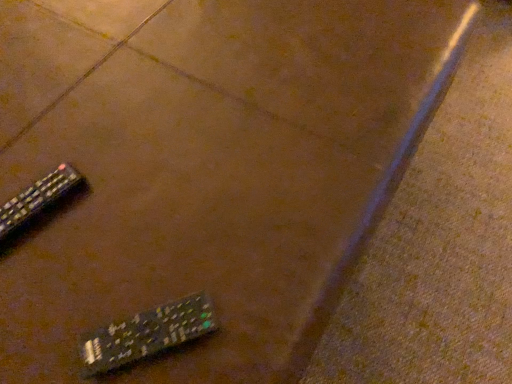
Image resolution: width=512 pixels, height=384 pixels. What are the coordinates of `vacant area that lies to the right of black plastic remote at lower left, which appears as the first remote control when ordered from the bottom` in the screenshot? It's located at (265, 297).